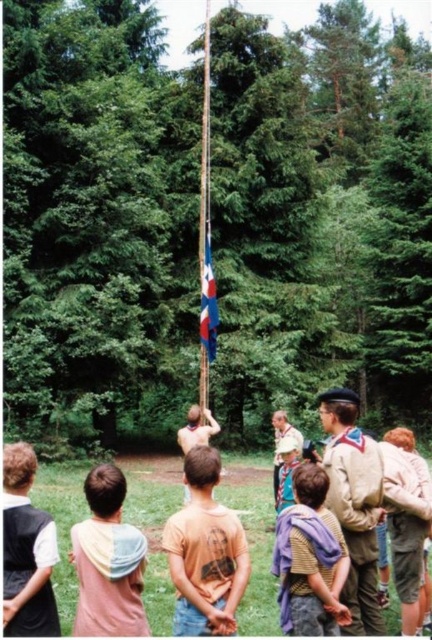
Question: Which object appears closest to the camera in this image?

Choices:
 (A) white cotton shirt at lower left
 (B) pastel hoodie at lower left

Answer: (B)

Question: Is pastel hoodie at lower left below striped cotton shirt at center?

Choices:
 (A) no
 (B) yes

Answer: (A)

Question: Which is farther from the pastel hoodie at lower left?

Choices:
 (A) white cotton shirt at lower left
 (B) striped cotton shirt at center

Answer: (B)

Question: Which object appears farthest from the camera in this image?

Choices:
 (A) brown cotton shirt at center
 (B) white cotton shirt at lower left
 (C) brown leather backpack at lower right

Answer: (C)

Question: Where is pastel hoodie at lower left located in relation to white cotton shirt at lower left in the image?

Choices:
 (A) above
 (B) below

Answer: (B)

Question: Can you confirm if blue fabric flag pole at center is positioned above light brown leather jacket at center?

Choices:
 (A) no
 (B) yes

Answer: (B)